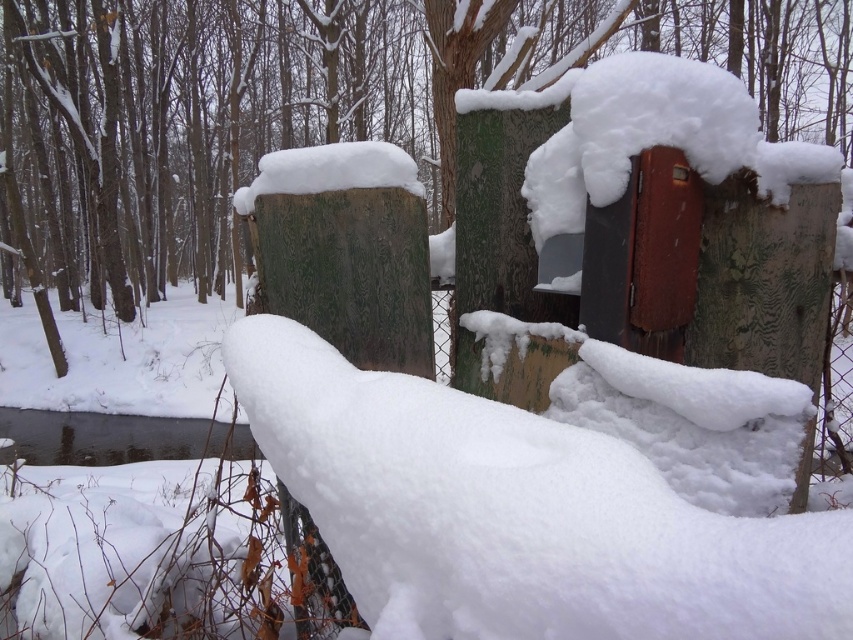
Between white fluffy snow at center and clear ice water at lower left, which one has more height?

With more height is white fluffy snow at center.

I want to click on white fluffy snow at center, so click(x=515, y=513).

The width and height of the screenshot is (853, 640). Find the location of `white fluffy snow at center`. white fluffy snow at center is located at coordinates (515, 513).